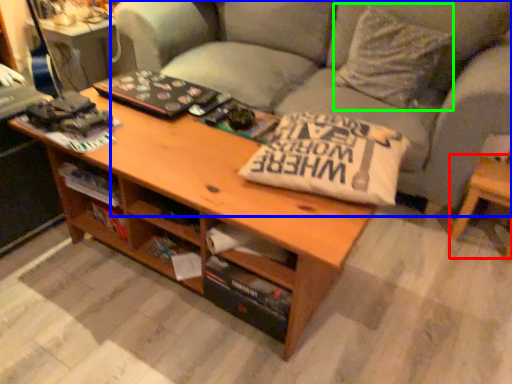
Question: Which object is the closest to the side table (highlighted by a red box)? Choose among these: studio couch (highlighted by a blue box) or throw pillow (highlighted by a green box).

Choices:
 (A) studio couch
 (B) throw pillow

Answer: (B)